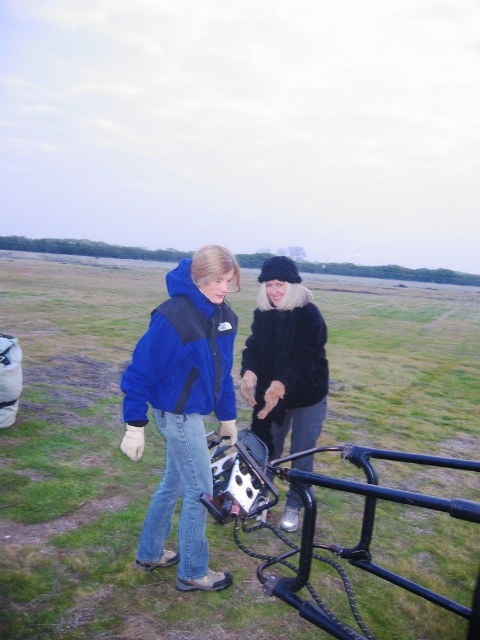
Who is shorter, blue fleece jacket at center or black metal rail at lower center?

With less height is black metal rail at lower center.

Is point (186, 579) positioned behind point (348, 627)?

Yes, it is behind point (348, 627).

You are a GUI agent. You are given a task and a screenshot of the screen. Output one action in this format:
    pyautogui.click(x=<x>, y=<y>)
    Task: Click on the blue fleece jacket at center
    
    Given the screenshot: What is the action you would take?
    pyautogui.click(x=183, y=406)

Is black matte camera at center shorter than black metal rail at lower center?

No, black matte camera at center is not shorter than black metal rail at lower center.

Does black matte camera at center have a smaller size compared to black metal rail at lower center?

Incorrect, black matte camera at center is not smaller in size than black metal rail at lower center.

Between point (444, 474) and point (368, 474), which one is positioned in front?

Point (368, 474) is more forward.

Image resolution: width=480 pixels, height=640 pixels. Identify the location of black matte camera at center. [x=96, y=474].

Can you confirm if blue fleece jacket at center is positioned above black fur coat at center?

Correct, blue fleece jacket at center is located above black fur coat at center.

Is blue fleece jacket at center bigger than black fur coat at center?

Indeed, blue fleece jacket at center has a larger size compared to black fur coat at center.

Does point (227, 582) come closer to viewer compared to point (297, 305)?

Yes.

Where is `blue fleece jacket at center`? blue fleece jacket at center is located at coordinates (183, 406).